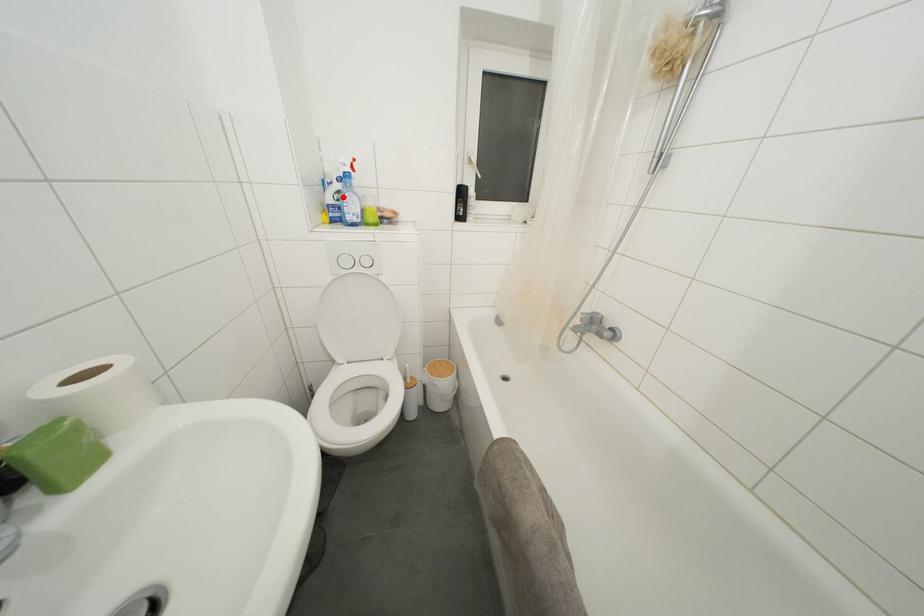
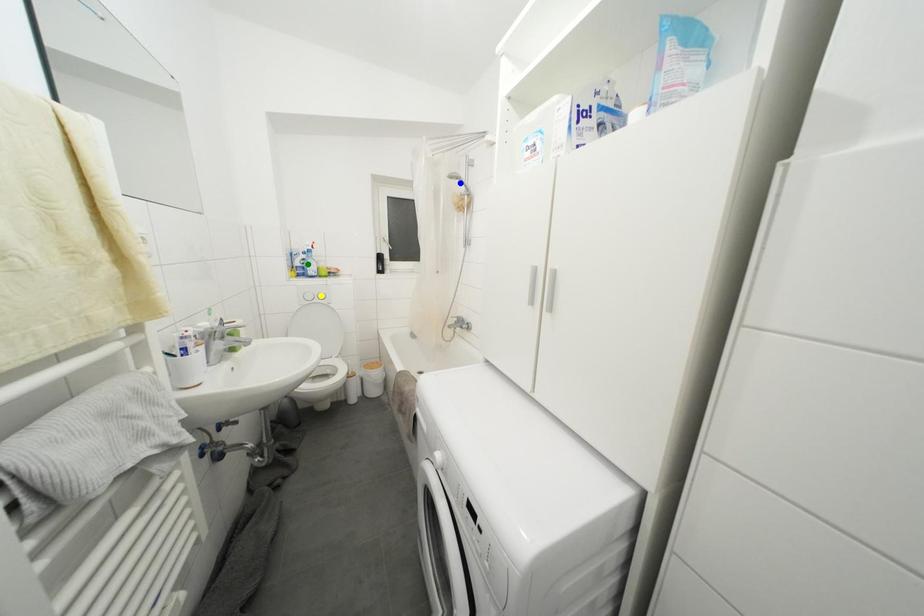
Question: I am providing you with two images of the same scene from different viewpoints. A red point is marked on the first image. You are given multiple points on the second image. Which point in image 2 is actually the same real-world point as the red point in image 1?

Choices:
 (A) yellow point
 (B) green point
 (C) blue point

Answer: (B)